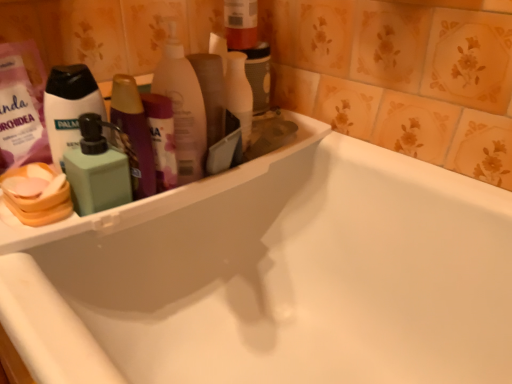
Question: In terms of height, does green matte pump bottle at left look taller or shorter compared to translucent plastic bottle at upper center, which is the second cleaning product from left to right?

Choices:
 (A) short
 (B) tall

Answer: (A)

Question: From the image's perspective, is green matte pump bottle at left positioned above or below translucent plastic bottle at upper center, which is the second cleaning product from left to right?

Choices:
 (A) below
 (B) above

Answer: (A)

Question: Estimate the real-world distances between objects in this image. Which object is closer to the white glossy bathtub at upper left?

Choices:
 (A) translucent plastic bottle at upper center, which is the first cleaning product in right-to-left order
 (B) green matte pump bottle at left
 (C) green matte soap dispenser at left, which is counted as the 2th cleaning product, starting from the right

Answer: (A)

Question: Estimate the real-world distances between objects in this image. Which object is closer to the white glossy bathtub at upper left?

Choices:
 (A) translucent plastic bottle at upper center, which is the second cleaning product from left to right
 (B) green matte pump bottle at left
 (C) green matte soap dispenser at left, which ranks as the 1th cleaning product in left-to-right order

Answer: (A)